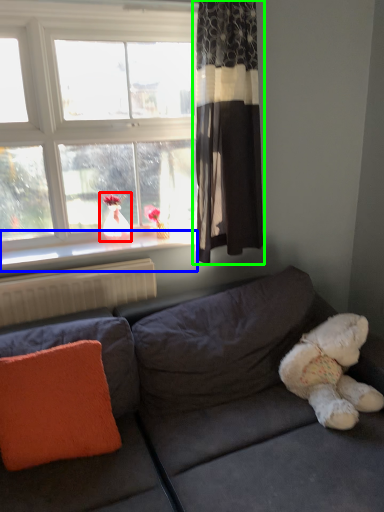
Question: Which object is positioned farthest from doll (highlighted by a red box)? Select from window sill (highlighted by a blue box) and curtain (highlighted by a green box).

Choices:
 (A) window sill
 (B) curtain

Answer: (B)